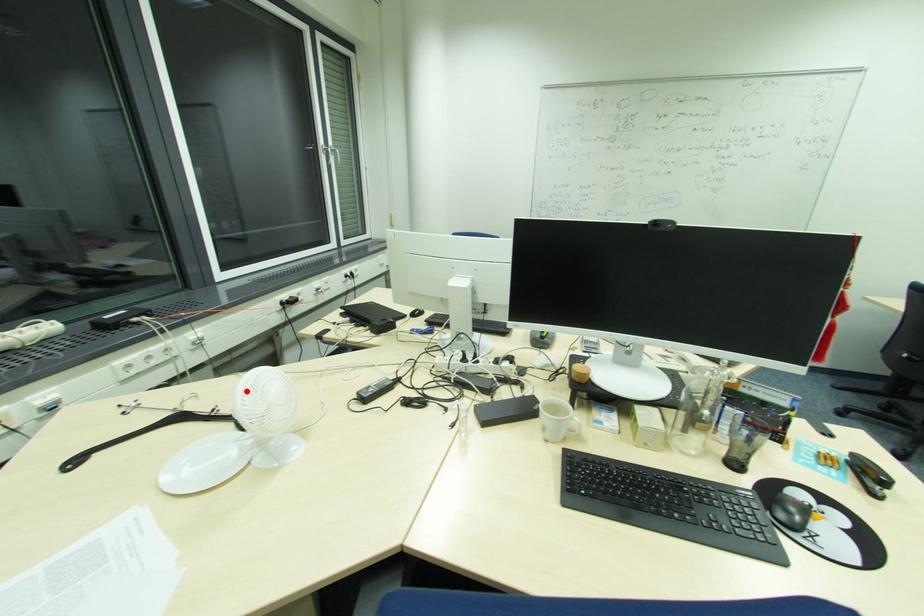
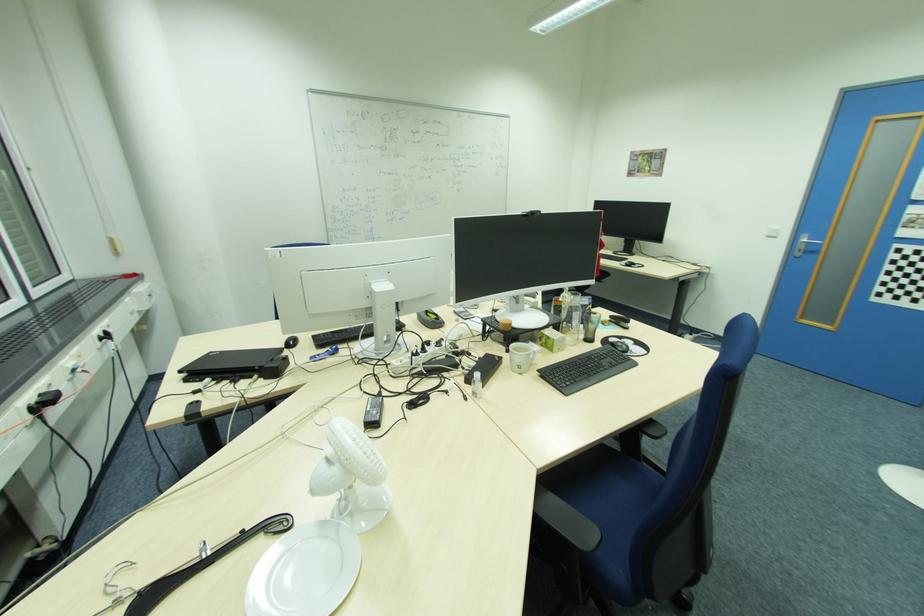
Question: I am providing you with two images of the same scene from different viewpoints. Given a red point in image1, look at the same physical point in image2. Is it:

Choices:
 (A) Closer to the viewpoint
 (B) Farther from the viewpoint

Answer: (A)